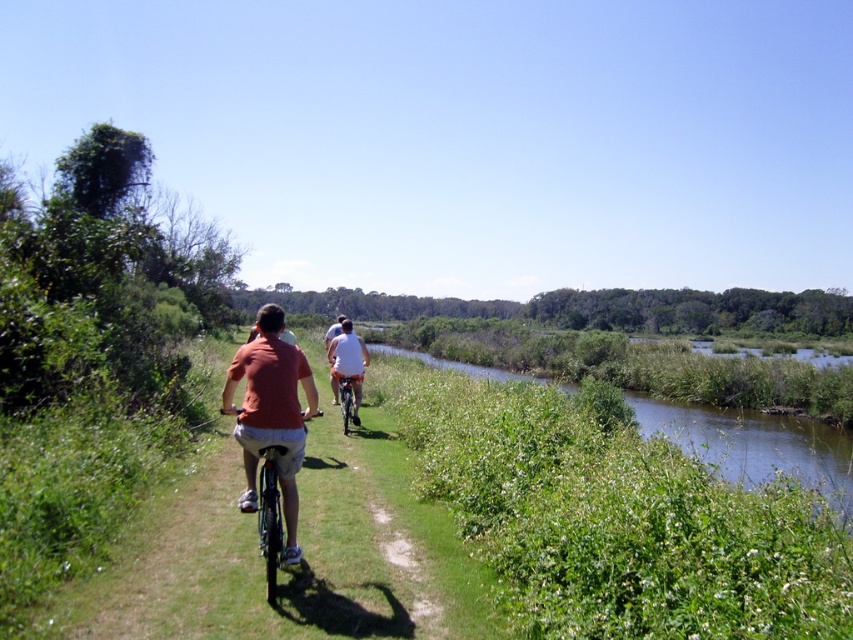
Question: In this image, where is green grassy waterway at right located relative to orange t-shirt at center?

Choices:
 (A) right
 (B) left

Answer: (A)

Question: Which object is farther from the camera taking this photo?

Choices:
 (A) white matte shirt at center
 (B) orange t-shirt at center

Answer: (A)

Question: Is green grassy waterway at right above orange t-shirt at center?

Choices:
 (A) no
 (B) yes

Answer: (A)

Question: Which point is farther to the camera?

Choices:
 (A) green grassy waterway at right
 (B) white matte shirt at center
 (C) orange t-shirt at center

Answer: (B)

Question: Which point is farther to the camera?

Choices:
 (A) (247, 458)
 (B) (338, 346)

Answer: (B)

Question: Where is green grassy waterway at right located in relation to white matte shirt at center in the image?

Choices:
 (A) left
 (B) right

Answer: (B)